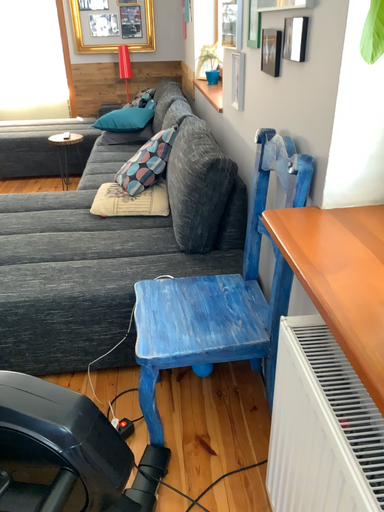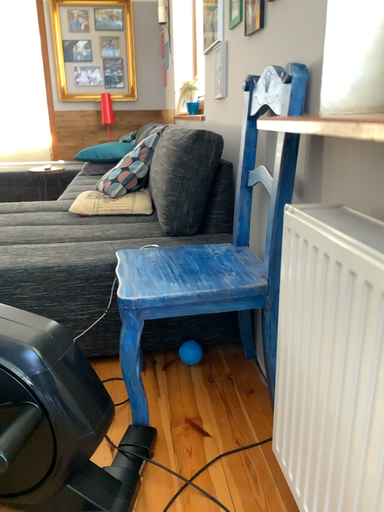
Question: How did the camera likely rotate when shooting the video?

Choices:
 (A) rotated upward
 (B) rotated downward

Answer: (A)